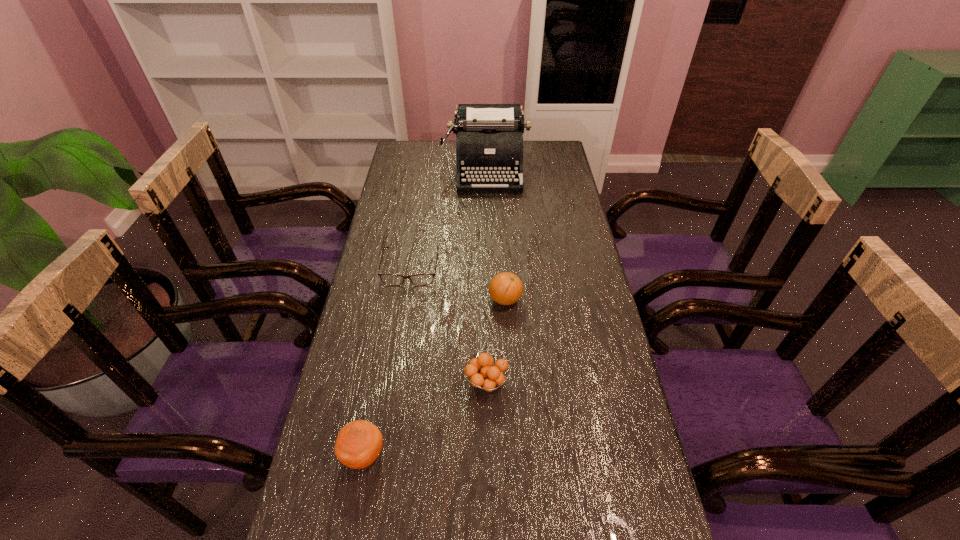
Identify the location of free space located on the front of the farthest orange fruit. (511, 392).

Locate an element on the screen. This screenshot has height=540, width=960. vacant area situated on the back of the second nearest object is located at coordinates (486, 330).

Where is `vacant region located on the lenses of the fourth nearest object`? Image resolution: width=960 pixels, height=540 pixels. vacant region located on the lenses of the fourth nearest object is located at coordinates (404, 308).

In order to click on object present at the far edge in this screenshot , I will do `click(489, 145)`.

The width and height of the screenshot is (960, 540). I want to click on orange at the left edge, so click(359, 443).

Where is `spectacles positioned at the left edge`? The image size is (960, 540). spectacles positioned at the left edge is located at coordinates (389, 279).

The width and height of the screenshot is (960, 540). I want to click on object present at the right edge, so click(489, 145).

What are the coordinates of `object present at the far right corner` in the screenshot? It's located at (489, 145).

At what (x,y) coordinates should I click in order to perform the action: click on vacant area at the far edge. Please return your answer as a coordinate pair (x, y). This screenshot has width=960, height=540. Looking at the image, I should click on tap(436, 158).

I want to click on vacant space at the left edge of the desktop, so click(380, 306).